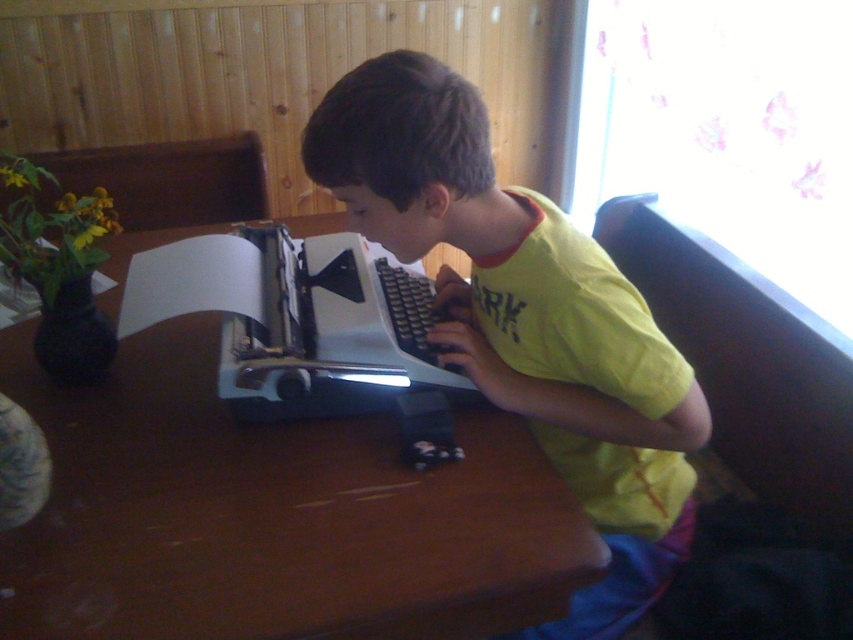
Looking at this image, does brown wooden table at center have a smaller size compared to yellow cotton shirt at center?

Actually, brown wooden table at center might be larger than yellow cotton shirt at center.

This screenshot has width=853, height=640. I want to click on brown wooden table at center, so click(x=271, y=515).

Which is behind, point (468, 611) or point (619, 308)?

The point (619, 308) is more distant.

Where is `brown wooden table at center`? The width and height of the screenshot is (853, 640). brown wooden table at center is located at coordinates (271, 515).